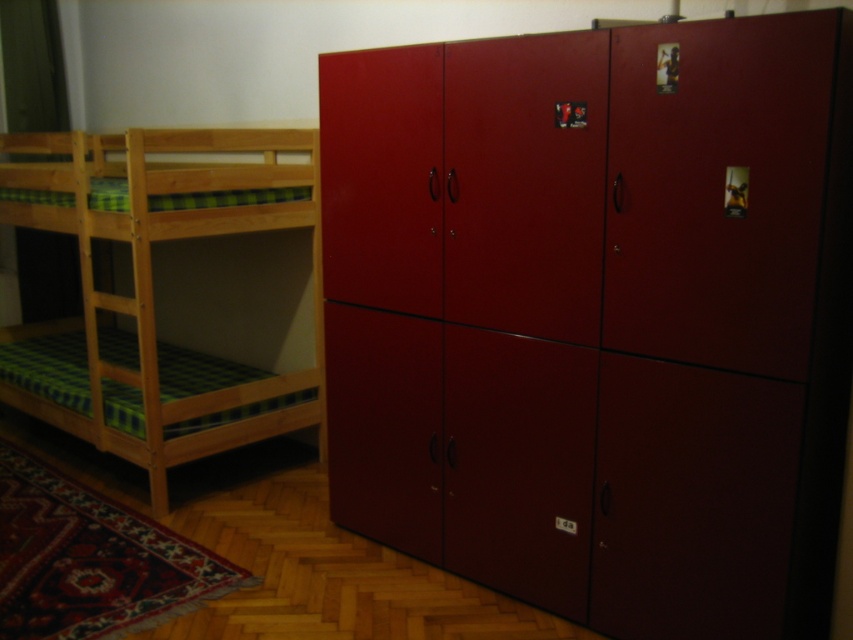
You are a parent setting up a child room. You want to place a small nightstand between the glossy wood dresser at right and the light brown wooden bunk bed at left. Is there enough space for the nightstand?

The glossy wood dresser at right is positioned under the light brown wooden bunk bed at left, so placing a nightstand between them would not be possible as they are vertically aligned rather than horizontally separated.

You are standing in the room and want to place a small plant exactly at the point with coordinates point (596,316). Where should you place it?

The point point (596,316) is located on the glossy wood dresser at right, so you should place the small plant on the glossy wood dresser at right.